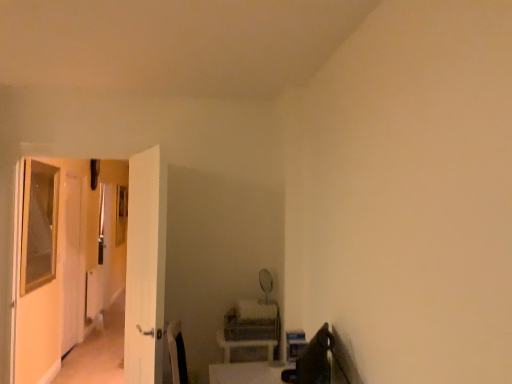
At what (x,y) coordinates should I click in order to perform the action: click on clear glass screen door at left, positioned as the 2th screen door in right-to-left order. Please return your answer as a coordinate pair (x, y). The height and width of the screenshot is (384, 512). Looking at the image, I should click on (71, 262).

Measure the distance between point [71,277] and camera.

The depth of point [71,277] is 4.70 meters.

I want to click on white glossy table at lower center, so click(246, 373).

Considering the sizes of objects white glossy table at lower center and white glossy door at left, placed as the first screen door when sorted from front to back, in the image provided, who is wider, white glossy table at lower center or white glossy door at left, placed as the first screen door when sorted from front to back,?

white glossy table at lower center is wider.

Which object is positioned more to the left, white glossy table at lower center or white glossy door at left, placed as the first screen door when sorted from front to back?

Positioned to the left is white glossy door at left, placed as the first screen door when sorted from front to back.

From the image's perspective, would you say white glossy table at lower center is positioned over white glossy door at left, marked as the 2th screen door in a left-to-right arrangement?

No, from the image's perspective, white glossy table at lower center is not on top of white glossy door at left, marked as the 2th screen door in a left-to-right arrangement.

Considering the positions of objects white glossy door at left, marked as the 2th screen door in a left-to-right arrangement, and green fabric swivel chair at lower right in the image provided, who is more to the right, white glossy door at left, marked as the 2th screen door in a left-to-right arrangement, or green fabric swivel chair at lower right?

From the viewer's perspective, green fabric swivel chair at lower right appears more on the right side.

Is white glossy door at left, the 1th screen door positioned from the right, taller or shorter than green fabric swivel chair at lower right?

Clearly, white glossy door at left, the 1th screen door positioned from the right, is taller compared to green fabric swivel chair at lower right.

Which is in front, point (128, 321) or point (313, 353)?

The point (313, 353) is closer to the camera.

Is white glossy door at left, which is the second screen door in back-to-front order, bigger than green fabric swivel chair at lower right?

Yes.

Which of these two, clear glass screen door at left, which is the 2th screen door in front-to-back order, or white glossy door at left, marked as the 2th screen door in a left-to-right arrangement, stands taller?

clear glass screen door at left, which is the 2th screen door in front-to-back order.

Considering the relative positions of clear glass screen door at left, which is the first screen door from left to right, and white glossy door at left, marked as the 2th screen door in a left-to-right arrangement, in the image provided, is clear glass screen door at left, which is the first screen door from left to right, to the right of white glossy door at left, marked as the 2th screen door in a left-to-right arrangement, from the viewer's perspective?

Incorrect, clear glass screen door at left, which is the first screen door from left to right, is not on the right side of white glossy door at left, marked as the 2th screen door in a left-to-right arrangement.

Looking at this image, is clear glass screen door at left, positioned as the 2th screen door in right-to-left order, looking in the opposite direction of white glossy door at left, placed as the first screen door when sorted from front to back?

No, clear glass screen door at left, positioned as the 2th screen door in right-to-left order, is not facing away from white glossy door at left, placed as the first screen door when sorted from front to back.

Considering the sizes of objects clear glass screen door at left, positioned as the 2th screen door in right-to-left order, and white glossy door at left, placed as the first screen door when sorted from front to back, in the image provided, who is thinner, clear glass screen door at left, positioned as the 2th screen door in right-to-left order, or white glossy door at left, placed as the first screen door when sorted from front to back,?

Thinner between the two is clear glass screen door at left, positioned as the 2th screen door in right-to-left order.

From the picture: Would you consider green fabric swivel chair at lower right to be distant from white glossy table at lower center?

No.

From a real-world perspective, is green fabric swivel chair at lower right positioned under white glossy table at lower center based on gravity?

No.

How far apart are green fabric swivel chair at lower right and white glossy table at lower center?

A distance of 12.04 inches exists between green fabric swivel chair at lower right and white glossy table at lower center.

Would you say white glossy table at lower center is part of green fabric swivel chair at lower right's contents?

No, white glossy table at lower center is not a part of green fabric swivel chair at lower right.

Does white glossy door at left, placed as the first screen door when sorted from front to back, have a larger size compared to white glossy table at lower center?

Indeed, white glossy door at left, placed as the first screen door when sorted from front to back, has a larger size compared to white glossy table at lower center.

From a real-world perspective, is white glossy door at left, the 1th screen door positioned from the right, under white glossy table at lower center?

Incorrect, from a real-world perspective, white glossy door at left, the 1th screen door positioned from the right, is higher than white glossy table at lower center.

Based on the photo, considering the relative sizes of white glossy door at left, placed as the first screen door when sorted from front to back, and white glossy table at lower center in the image provided, is white glossy door at left, placed as the first screen door when sorted from front to back, wider than white glossy table at lower center?

In fact, white glossy door at left, placed as the first screen door when sorted from front to back, might be narrower than white glossy table at lower center.

Which object is closer to the camera taking this photo, white glossy table at lower center or green fabric swivel chair at lower right?

Positioned in front is green fabric swivel chair at lower right.

Is white glossy table at lower center not within green fabric swivel chair at lower right?

Indeed, white glossy table at lower center is completely outside green fabric swivel chair at lower right.

Is white glossy table at lower center with green fabric swivel chair at lower right?

No, white glossy table at lower center is not touching green fabric swivel chair at lower right.

Is white glossy table at lower center to the left or to the right of green fabric swivel chair at lower right in the image?

white glossy table at lower center is to the left of green fabric swivel chair at lower right.

Does clear glass screen door at left, which is the first screen door from left to right, have a greater width compared to green fabric swivel chair at lower right?

Incorrect, the width of clear glass screen door at left, which is the first screen door from left to right, does not surpass that of green fabric swivel chair at lower right.

Considering the sizes of objects clear glass screen door at left, which is the first screen door from left to right, and green fabric swivel chair at lower right in the image provided, who is shorter, clear glass screen door at left, which is the first screen door from left to right, or green fabric swivel chair at lower right?

With less height is green fabric swivel chair at lower right.

In the scene shown: Is the position of clear glass screen door at left, the 1th screen door positioned from the back, more distant than that of green fabric swivel chair at lower right?

Yes, the depth of clear glass screen door at left, the 1th screen door positioned from the back, is greater than that of green fabric swivel chair at lower right.

Is clear glass screen door at left, the 1th screen door positioned from the back, situated inside green fabric swivel chair at lower right or outside?

clear glass screen door at left, the 1th screen door positioned from the back, is not enclosed by green fabric swivel chair at lower right.

Identify the location of table located below the white glossy door at left, the 1th screen door positioned from the right (from the image's perspective). (246, 373).

There is a green fabric swivel chair at lower right. Where is `the 2nd screen door above it (from the image's perspective)`? This screenshot has width=512, height=384. the 2nd screen door above it (from the image's perspective) is located at coordinates (145, 267).

When comparing their distances from white glossy door at left, the 1th screen door positioned from the right, does green fabric swivel chair at lower right or white glossy table at lower center seem further?

Among the two, green fabric swivel chair at lower right is located further to white glossy door at left, the 1th screen door positioned from the right.

From the image, which object appears to be nearer to clear glass screen door at left, the 1th screen door positioned from the back, white glossy door at left, marked as the 2th screen door in a left-to-right arrangement, or white glossy table at lower center?

white glossy door at left, marked as the 2th screen door in a left-to-right arrangement.

Based on their spatial positions, is white glossy table at lower center or white glossy door at left, which is the second screen door in back-to-front order, closer to green fabric swivel chair at lower right?

white glossy table at lower center is closer to green fabric swivel chair at lower right.

When comparing their distances from white glossy door at left, marked as the 2th screen door in a left-to-right arrangement, does green fabric swivel chair at lower right or clear glass screen door at left, the 1th screen door positioned from the back, seem closer?

The object closer to white glossy door at left, marked as the 2th screen door in a left-to-right arrangement, is green fabric swivel chair at lower right.

Estimate the real-world distances between objects in this image. Which object is further from green fabric swivel chair at lower right, white glossy table at lower center or clear glass screen door at left, the 1th screen door positioned from the back?

clear glass screen door at left, the 1th screen door positioned from the back.

In the scene shown: Considering their positions, is white glossy table at lower center positioned closer to clear glass screen door at left, the 1th screen door positioned from the back, than green fabric swivel chair at lower right?

white glossy table at lower center.

From the image, which object appears to be nearer to white glossy table at lower center, white glossy door at left, the 1th screen door positioned from the right, or green fabric swivel chair at lower right?

green fabric swivel chair at lower right is positioned closer to the anchor white glossy table at lower center.

Looking at the image, which one is located further to clear glass screen door at left, which is the first screen door from left to right, white glossy table at lower center or white glossy door at left, the 1th screen door positioned from the right?

white glossy table at lower center lies further to clear glass screen door at left, which is the first screen door from left to right, than the other object.

In order to click on table located between white glossy door at left, marked as the 2th screen door in a left-to-right arrangement, and green fabric swivel chair at lower right in the left-right direction in this screenshot , I will do `click(246, 373)`.

Locate an element on the screen. This screenshot has width=512, height=384. screen door located between white glossy table at lower center and clear glass screen door at left, which is the first screen door from left to right, in the depth direction is located at coordinates (145, 267).

Image resolution: width=512 pixels, height=384 pixels. I want to click on screen door located between green fabric swivel chair at lower right and clear glass screen door at left, positioned as the 2th screen door in right-to-left order, in the depth direction, so click(x=145, y=267).

Locate an element on the screen. table positioned between green fabric swivel chair at lower right and clear glass screen door at left, which is the 2th screen door in front-to-back order, from near to far is located at coordinates (x=246, y=373).